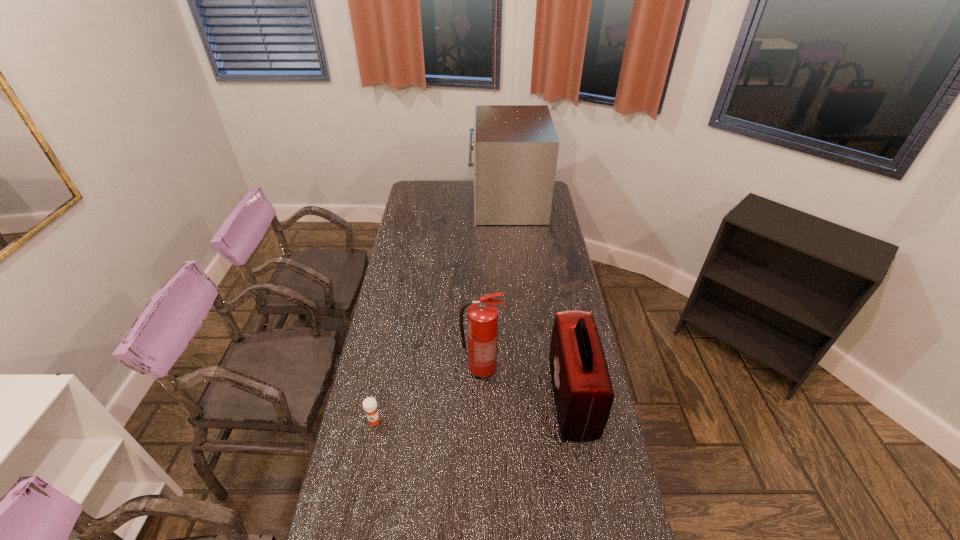
The image size is (960, 540). Find the location of `free space at the right edge of the desktop`. free space at the right edge of the desktop is located at coordinates (564, 471).

I want to click on vacant space that is in between the toaster oven and the shortest object, so (x=441, y=312).

Where is `free space between the toaster oven and the fire extinguisher`? The height and width of the screenshot is (540, 960). free space between the toaster oven and the fire extinguisher is located at coordinates (494, 286).

Find the location of a particular element. This screenshot has width=960, height=540. vacant space in between the tallest object and the fire extinguisher is located at coordinates (494, 286).

The width and height of the screenshot is (960, 540). Identify the location of unoccupied position between the second shortest object and the farthest object. (540, 300).

Identify the location of vacant space that's between the leftmost object and the fire extinguisher. The image size is (960, 540). (428, 395).

This screenshot has height=540, width=960. I want to click on free space between the second shortest object and the tallest object, so point(540,300).

Locate an element on the screen. The image size is (960, 540). free space between the first aid kit and the fire extinguisher is located at coordinates (527, 383).

This screenshot has height=540, width=960. In order to click on vacant region between the first aid kit and the toaster oven in this screenshot , I will do `click(540, 300)`.

The width and height of the screenshot is (960, 540). Identify the location of vacant area that lies between the toaster oven and the third tallest object. tap(540, 300).